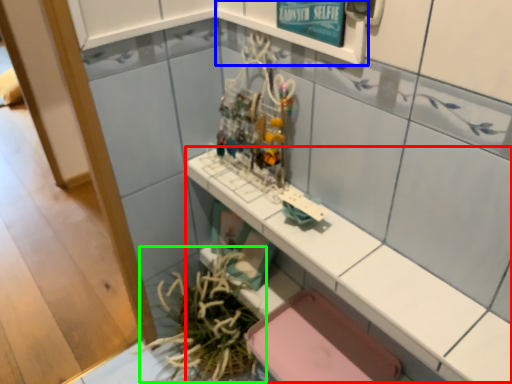
Question: Which object is the farthest from counter top (highlighted by a red box)? Choose among these: shelf (highlighted by a blue box) or plant (highlighted by a green box).

Choices:
 (A) shelf
 (B) plant

Answer: (B)